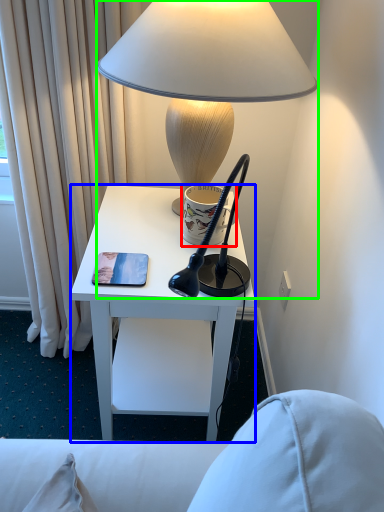
Question: Which is farther away from coffee cup (highlighted by a red box)? desk (highlighted by a blue box) or lamp (highlighted by a green box)?

Choices:
 (A) desk
 (B) lamp

Answer: (B)